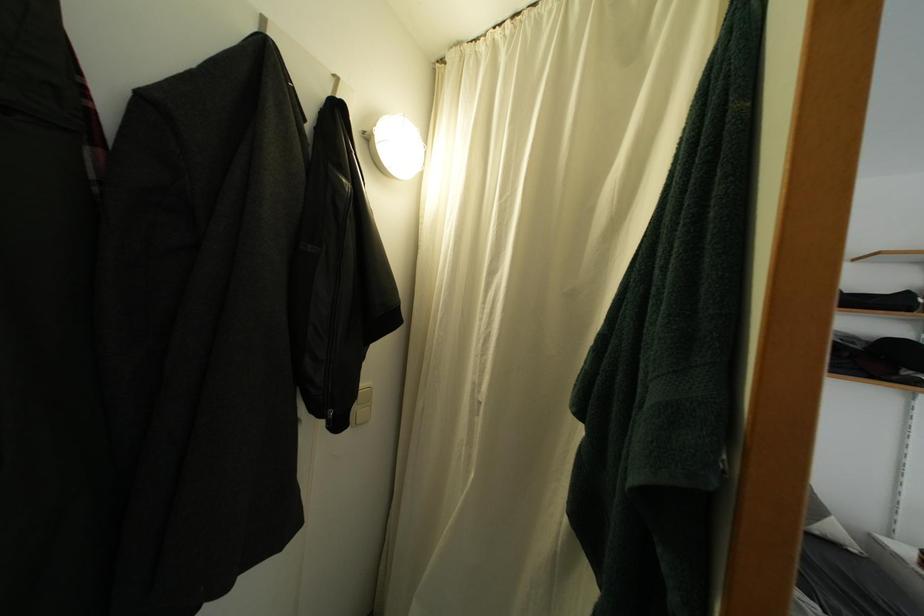
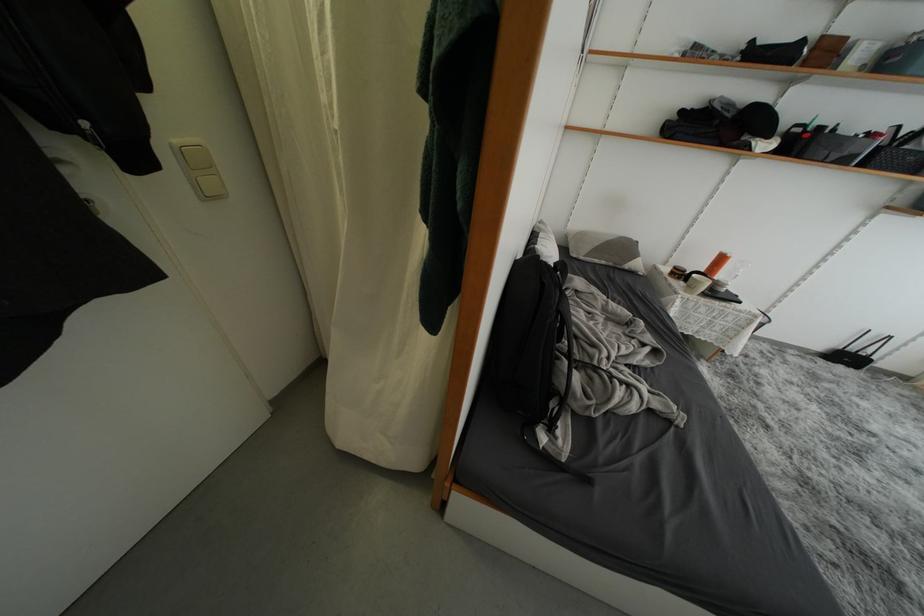
Looking at this image, first-person continuous shooting, in which direction is the camera rotating?

The camera rotated toward right-down.